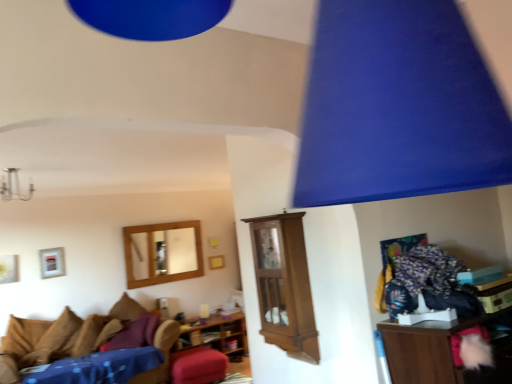
Question: From a real-world perspective, is wooden cabinet at center, marked as the first shelf in a front-to-back arrangement, physically located above or below brown suede pillow at lower left, which is the first pillow from front to back?

Choices:
 (A) below
 (B) above

Answer: (B)

Question: From their relative heights in the image, would you say wooden cabinet at center, the 2th shelf in the bottom-to-top sequence, is taller or shorter than brown suede pillow at lower left, which is the 2th pillow in back-to-front order?

Choices:
 (A) short
 (B) tall

Answer: (B)

Question: Which of these objects is positioned closest to the velvet red stool at center?

Choices:
 (A) velvet purple sofa at lower left
 (B) wooden/matte picture frame at center, which is the first picture frame in back-to-front order
 (C) brown fabric pillow at lower left, which is counted as the 2th pillow, starting from the front
 (D) silver metallic picture frame at upper left, which is counted as the 1th picture frame, starting from the left
 (E) wooden cabinet at center, the 2th shelf in the bottom-to-top sequence

Answer: (C)

Question: Which of these objects is positioned farthest from the velvet purple sofa at lower left?

Choices:
 (A) brown suede pillow at lower left, which is the 2th pillow in back-to-front order
 (B) brown fabric pillow at lower left, the first pillow positioned from the back
 (C) metallic chandelier at upper left
 (D) wooden cabinet at center, the second shelf from the back
 (E) wooden/matte picture frame at center, placed as the second picture frame when sorted from front to back

Answer: (D)